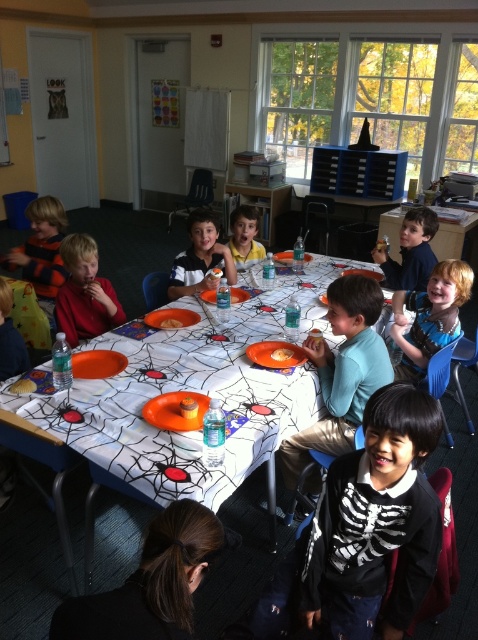
Which is above, white paper table at center or black matte skeleton costume at center?

Positioned higher is white paper table at center.

Find the location of a particular element. The width and height of the screenshot is (478, 640). white paper table at center is located at coordinates (194, 390).

Image resolution: width=478 pixels, height=640 pixels. Identify the location of white paper table at center. (194, 390).

Identify the location of white paper table at center. (194, 390).

Does black matte skeleton costume at center come in front of striped sweater at left?

Yes, it is.

Is point (409, 538) closer to camera compared to point (54, 273)?

Yes, point (409, 538) is closer to viewer.

This screenshot has height=640, width=478. I want to click on black matte skeleton costume at center, so click(x=378, y=513).

In the scene shown: Does white paper table at center have a lesser height compared to light brown hair at center?

No, white paper table at center is not shorter than light brown hair at center.

From the picture: Can you confirm if white paper table at center is positioned below light brown hair at center?

Yes, white paper table at center is below light brown hair at center.

The width and height of the screenshot is (478, 640). Describe the element at coordinates (194, 390) in the screenshot. I see `white paper table at center` at that location.

Identify the location of white paper table at center. (194, 390).